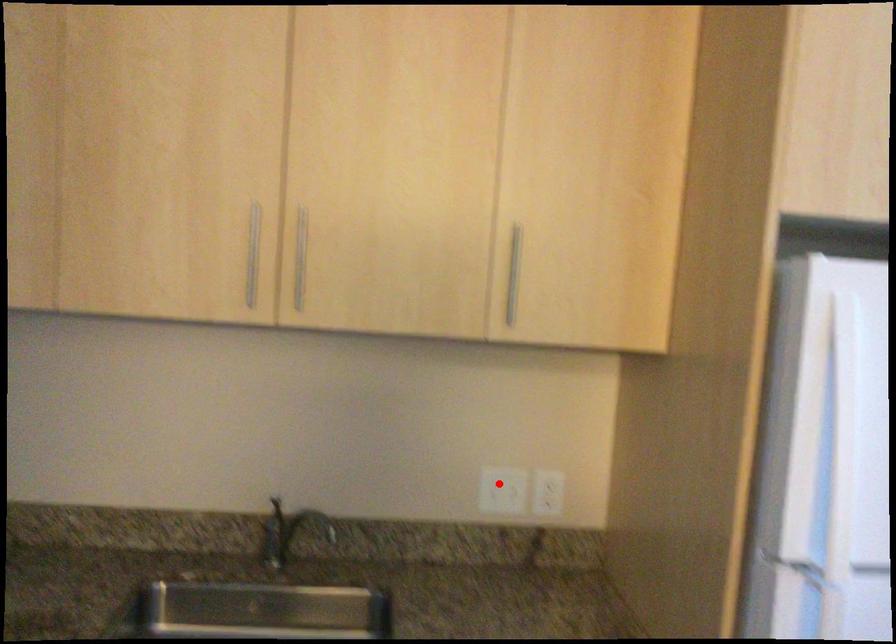
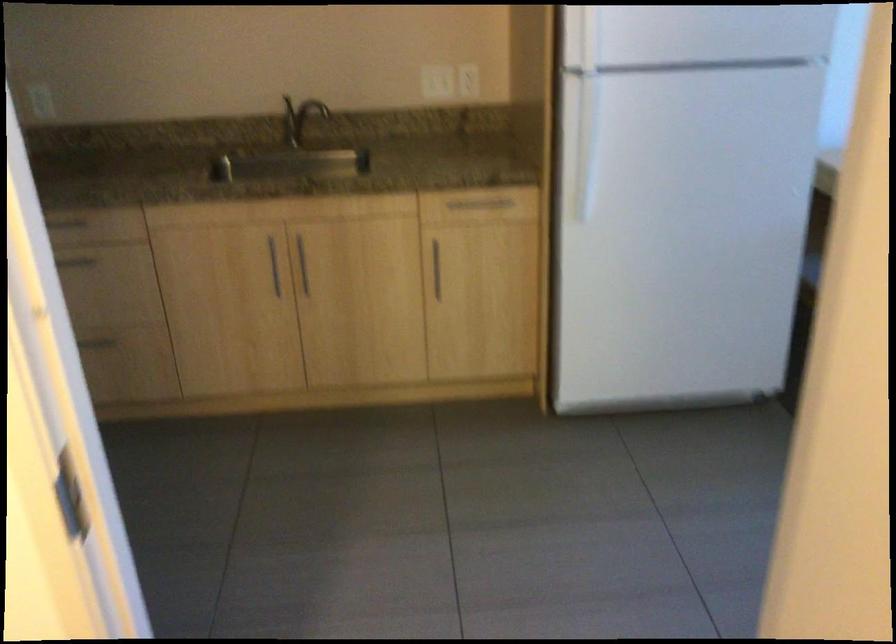
Question: I am providing you with two images of the same scene from different viewpoints. In image1, a red point is highlighted. Considering the same 3D point in image2, which of the following is correct?

Choices:
 (A) It is closer
 (B) It is farther

Answer: (B)